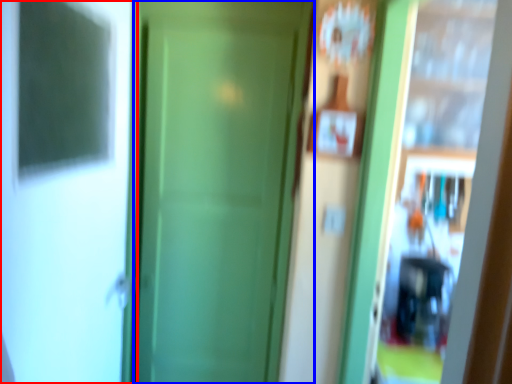
Question: Which object appears closest to the camera in this image, screen door (highlighted by a red box) or door (highlighted by a blue box)?

Choices:
 (A) screen door
 (B) door

Answer: (A)